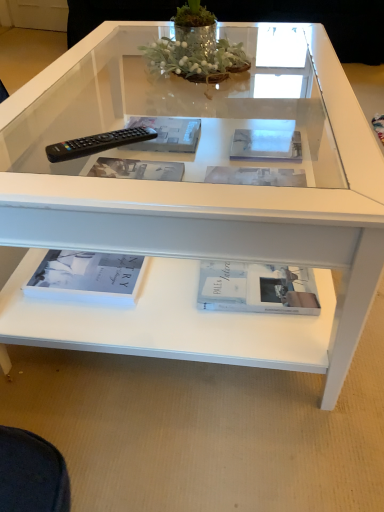
Locate an element on the screen. Image resolution: width=384 pixels, height=512 pixels. blank space situated above matte gray book at lower left, marked as the first book in a left-to-right arrangement (from a real-world perspective) is located at coordinates (86, 265).